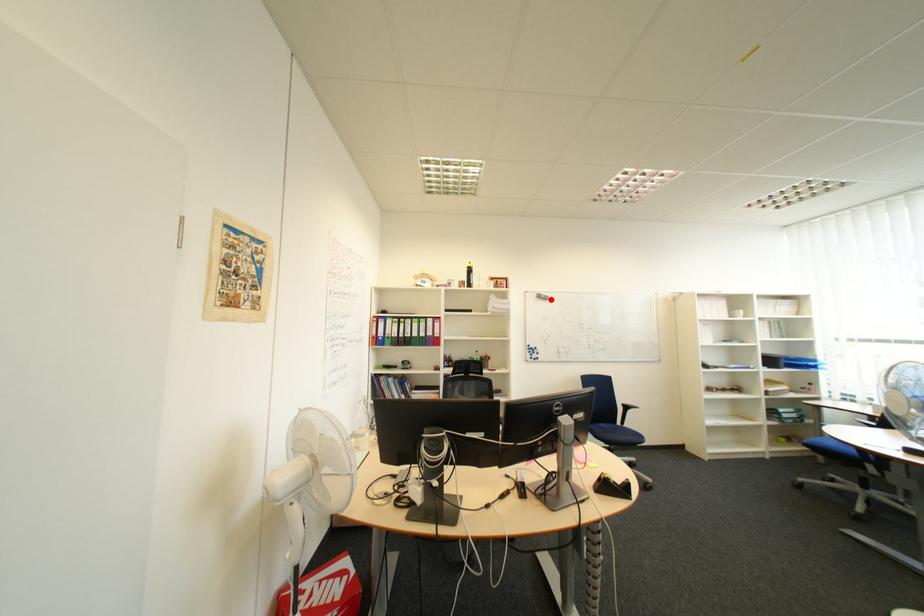
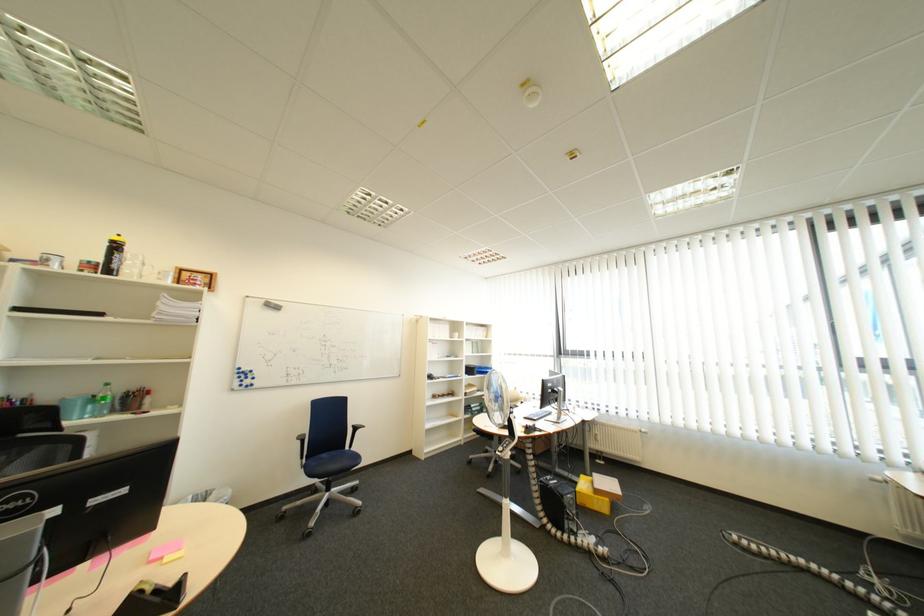
The point at the highlighted location is marked in the first image. Where is the corresponding point in the second image?

(277, 309)